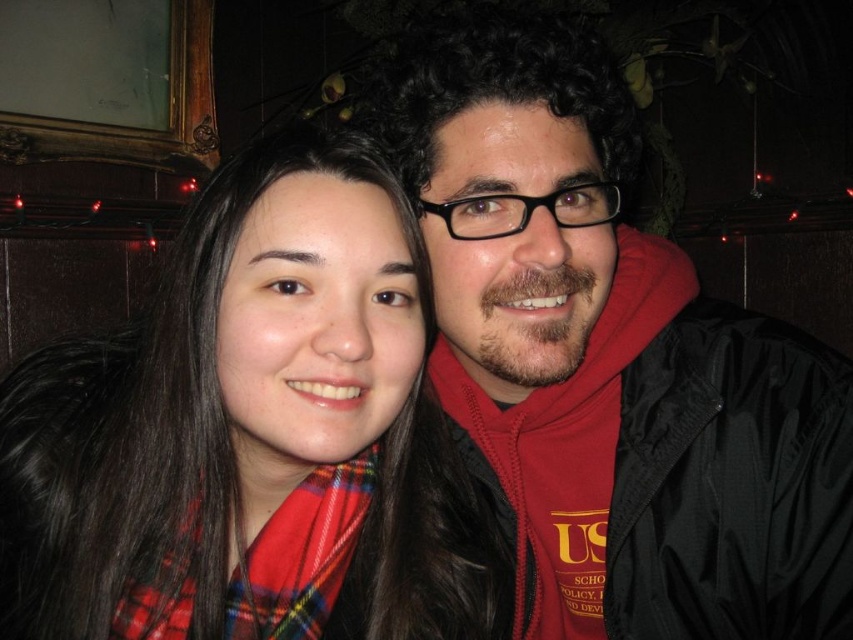
Question: Does black matte jacket at right have a lesser width compared to plaid scarf at left?

Choices:
 (A) yes
 (B) no

Answer: (B)

Question: Which point appears closest to the camera in this image?

Choices:
 (A) (509, 179)
 (B) (320, 179)

Answer: (B)

Question: Is black matte jacket at right above plaid scarf at left?

Choices:
 (A) no
 (B) yes

Answer: (B)

Question: Which point is farther to the camera?

Choices:
 (A) black matte jacket at right
 (B) plaid scarf at left

Answer: (A)

Question: Can you confirm if black matte jacket at right is positioned above plaid scarf at left?

Choices:
 (A) yes
 (B) no

Answer: (A)

Question: Among these points, which one is farthest from the camera?

Choices:
 (A) (260, 552)
 (B) (749, 550)

Answer: (B)